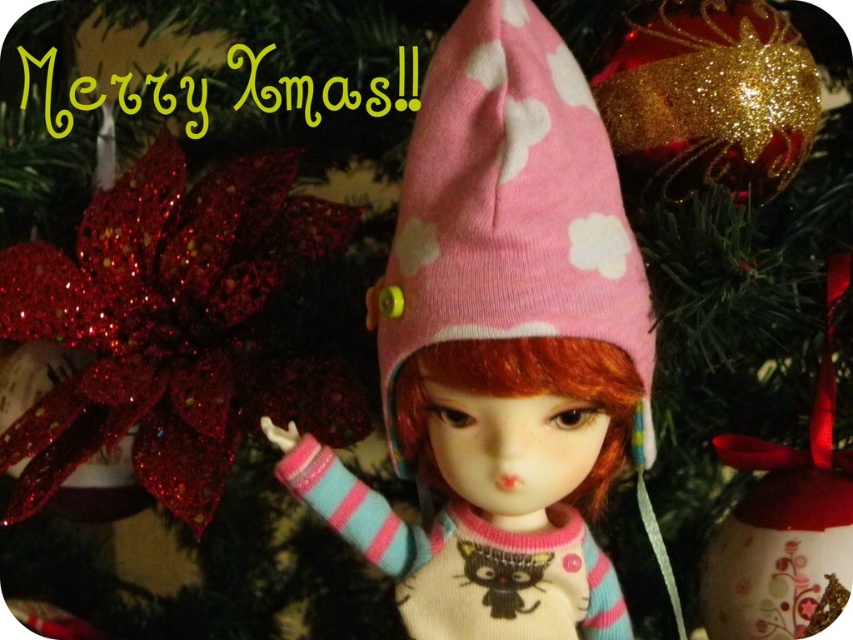
You are a photographer trying to capture the sparkly red flower at left in the scene. The camera you are using has a focus point at coordinates 0.5, 0.2. Will the flower be in focus?

The sparkly red flower at left is at point (173, 326), which is very close to the camera focus point at (170, 320). Therefore, the flower will be in focus.

You are a photographer trying to capture the sparkly red flower at left. The camera is at point 0.0, 0.0. The scene is on a grid from 0.0 to 1.0 in both x and y. The sparkly red flower at left is at point (173, 326). Which direction should you move the camera to get closer to the sparkly red flower at left?

The sparkly red flower at left is located at point (173, 326). Since the camera is at 0.0, 0.0, you should move the camera to the right and upwards to reach the flower.

You are a child trying to decide which gift to choose for your doll. The sparkly red flower at left and the pink knitted hat at center are both options. If you want to give the doll a gift that covers more area, which one should you choose?

The sparkly red flower at left might be wider than the pink knitted hat at center, so it could cover more area and be the better choice.